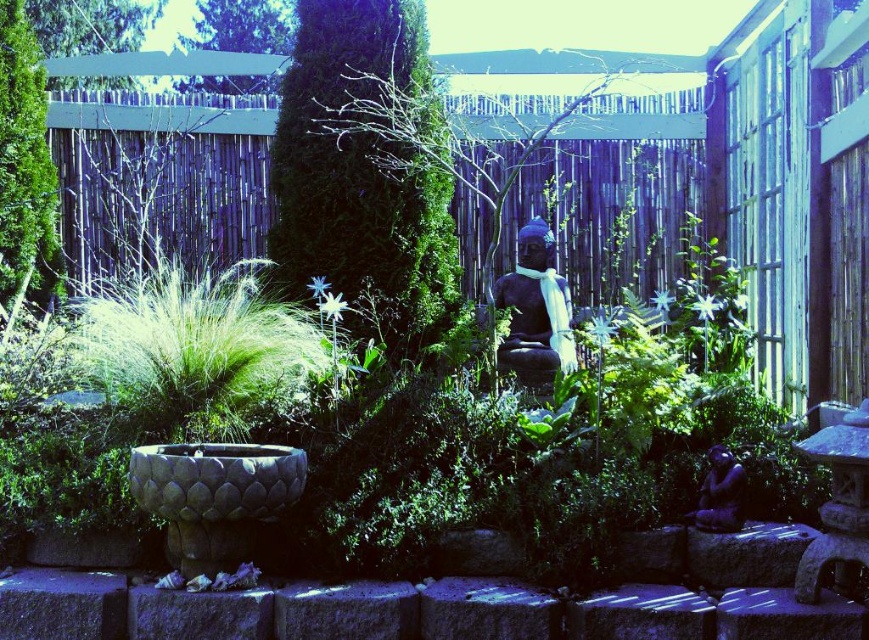
You are a gardener planning to trim the green textured bush at center and the satin black statue at center. Considering their sizes, which object requires more time to maintain?

The green textured bush at center requires more time to maintain because it has a larger size compared to the satin black statue at center.

You are standing in the garden and want to place a small potted plant between the two points, point 1 at point [11,208] and point 2 at point [549,314]. Which point is closer to you so you can start placing the plant there?

Point 1 at point [11,208] is closer to you than point 2 at point [549,314], so you should start placing the plant near point 1 at point [11,208] first.

You are a visitor in the garden and want to take a photo of the black stone statue at center without the green textured bush at left blocking the view. Is there a way to position yourself so that the statue is visible without the bush in the frame?

The black stone statue at center is behind the green textured bush at left, so if you move to a position where the statue is not obscured by the bush, you can take the photo. For example, moving to the right side of the garden might allow you to see the statue without the bush blocking it.